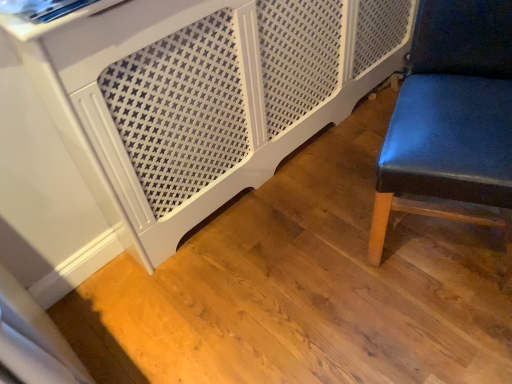
Where is `free space in front of blue leather chair at right`? The image size is (512, 384). free space in front of blue leather chair at right is located at coordinates (434, 331).